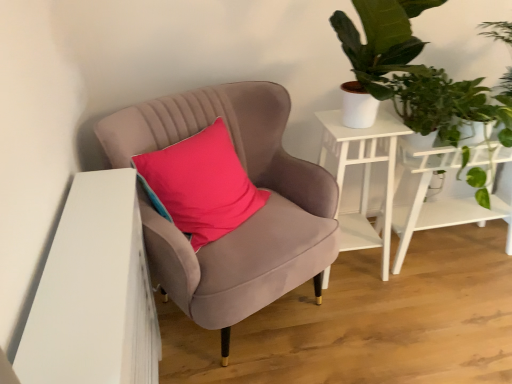
This screenshot has width=512, height=384. I want to click on free location in front of white matte table at right, positioned as the second table in left-to-right order, so click(454, 310).